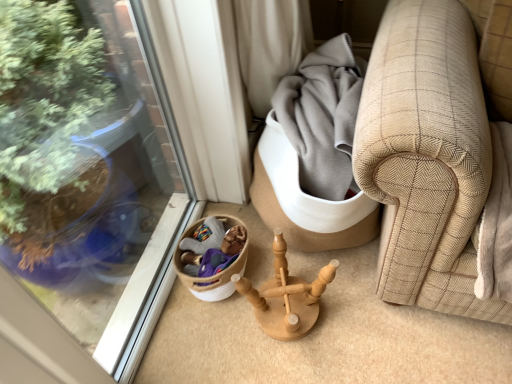
Question: Is woven beige basket at lower left at the right side of natural wood candlestick holder at center?

Choices:
 (A) no
 (B) yes

Answer: (A)

Question: Is woven beige basket at lower left aimed at natural wood candlestick holder at center?

Choices:
 (A) no
 (B) yes

Answer: (B)

Question: From a real-world perspective, is woven beige basket at lower left on natural wood candlestick holder at center?

Choices:
 (A) yes
 (B) no

Answer: (B)

Question: From a real-world perspective, is woven beige basket at lower left positioned under natural wood candlestick holder at center based on gravity?

Choices:
 (A) no
 (B) yes

Answer: (B)

Question: Is woven beige basket at lower left turned away from natural wood candlestick holder at center?

Choices:
 (A) yes
 (B) no

Answer: (B)

Question: Can you confirm if woven beige basket at lower left is thinner than natural wood candlestick holder at center?

Choices:
 (A) yes
 (B) no

Answer: (A)

Question: Can you confirm if natural wood candlestick holder at center is positioned to the right of woven beige basket at lower left?

Choices:
 (A) yes
 (B) no

Answer: (A)

Question: From a real-world perspective, is natural wood candlestick holder at center on woven beige basket at lower left?

Choices:
 (A) no
 (B) yes

Answer: (B)

Question: Considering the relative sizes of natural wood candlestick holder at center and woven beige basket at lower left in the image provided, is natural wood candlestick holder at center thinner than woven beige basket at lower left?

Choices:
 (A) yes
 (B) no

Answer: (B)

Question: Is natural wood candlestick holder at center positioned behind woven beige basket at lower left?

Choices:
 (A) yes
 (B) no

Answer: (B)

Question: Considering the relative sizes of natural wood candlestick holder at center and woven beige basket at lower left in the image provided, is natural wood candlestick holder at center shorter than woven beige basket at lower left?

Choices:
 (A) no
 (B) yes

Answer: (A)

Question: From the image's perspective, does natural wood candlestick holder at center appear lower than woven beige basket at lower left?

Choices:
 (A) yes
 (B) no

Answer: (A)

Question: Is woven beige basket at lower left to the left or to the right of natural wood candlestick holder at center in the image?

Choices:
 (A) left
 (B) right

Answer: (A)